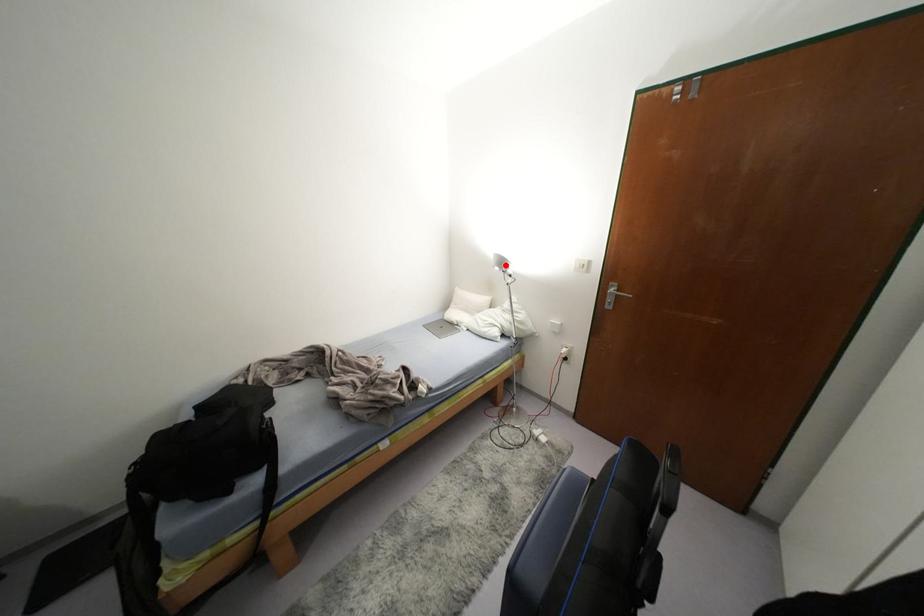
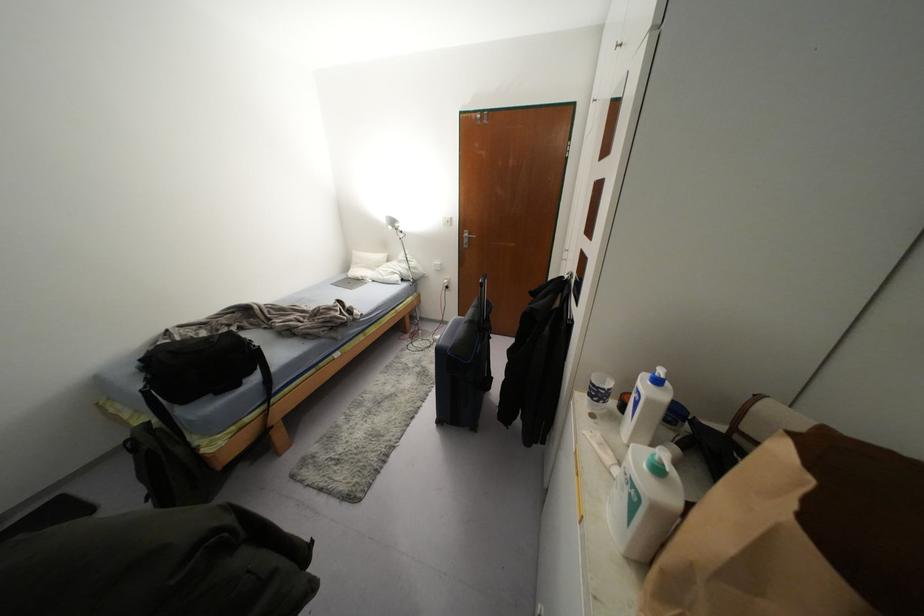
Locate, in the second image, the point that corresponds to the highlighted location in the first image.

(395, 225)